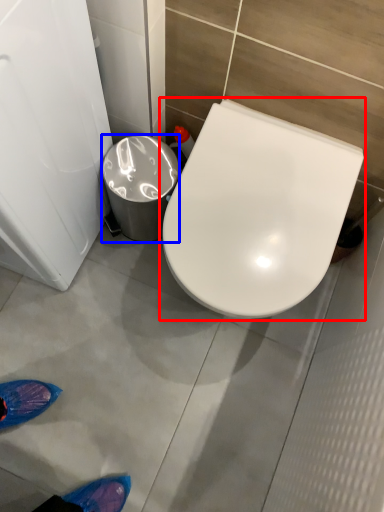
Question: Which object is further to the camera taking this photo, toilet (highlighted by a red box) or trash bin/can (highlighted by a blue box)?

Choices:
 (A) toilet
 (B) trash bin/can

Answer: (B)